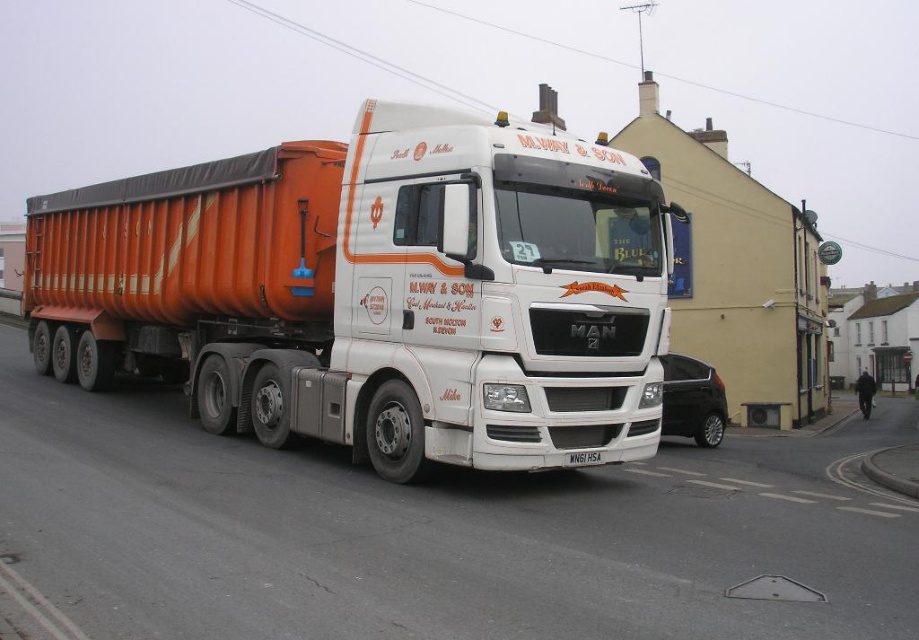
Question: Is orange metallic trailer at left below white plastic license plate at center?

Choices:
 (A) yes
 (B) no

Answer: (B)

Question: Which point is farther to the camera?

Choices:
 (A) orange metallic trailer at left
 (B) white plastic license plate at center

Answer: (B)

Question: Does orange metallic trailer at left appear over white plastic license plate at center?

Choices:
 (A) yes
 (B) no

Answer: (A)

Question: Which point is farther to the camera?

Choices:
 (A) white plastic license plate at center
 (B) orange metallic trailer at left

Answer: (A)

Question: Can you confirm if orange metallic trailer at left is bigger than white plastic license plate at center?

Choices:
 (A) no
 (B) yes

Answer: (B)

Question: Which object appears closest to the camera in this image?

Choices:
 (A) white plastic license plate at center
 (B) orange metallic trailer at left

Answer: (B)